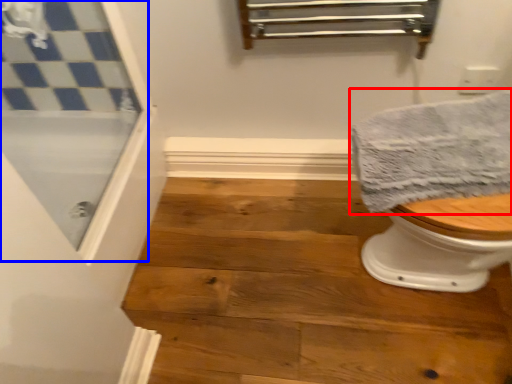
Question: Which object is closer to the camera taking this photo, towel (highlighted by a red box) or screen door (highlighted by a blue box)?

Choices:
 (A) towel
 (B) screen door

Answer: (B)